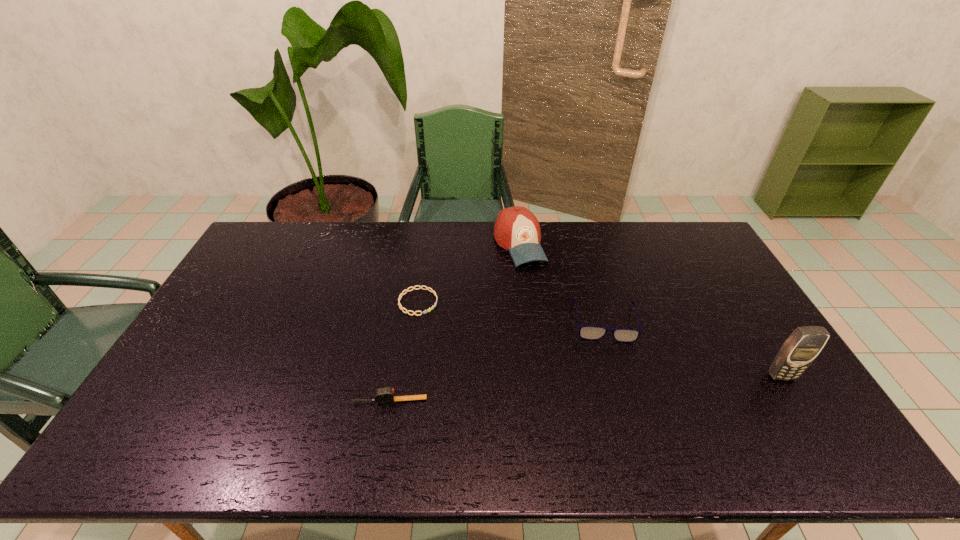
Locate an element on the screen. object at the far edge is located at coordinates (516, 229).

You are a GUI agent. You are given a task and a screenshot of the screen. Output one action in this format:
    pyautogui.click(x=<x>, y=<y>)
    Task: Click on the object that is at the near edge
    
    Given the screenshot: What is the action you would take?
    pyautogui.click(x=386, y=395)

Identify the location of object that is at the right edge. click(801, 348).

At what (x,y) coordinates should I click in order to perform the action: click on vacant area at the far edge. Please return your answer as a coordinate pair (x, y). Looking at the image, I should click on (569, 228).

The width and height of the screenshot is (960, 540). In the image, there is a desktop. What are the coordinates of `vacant space at the near edge` in the screenshot? It's located at (569, 402).

The height and width of the screenshot is (540, 960). Identify the location of vacant space at the left edge. (230, 281).

In the image, there is a desktop. Find the location of `free space at the right edge`. free space at the right edge is located at coordinates (731, 345).

Identify the location of free spot at the near left corner of the desktop. This screenshot has height=540, width=960. (177, 405).

This screenshot has width=960, height=540. In the image, there is a desktop. In order to click on vacant space at the far right corner in this screenshot , I will do `click(683, 248)`.

You are a GUI agent. You are given a task and a screenshot of the screen. Output one action in this format:
    pyautogui.click(x=<x>, y=<y>)
    Task: Click on the vacant space that's between the shortest object and the baseball cap
    
    Given the screenshot: What is the action you would take?
    click(x=468, y=273)